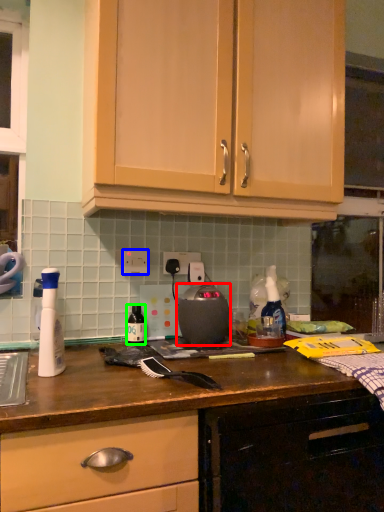
Question: Which is farther away from home appliance (highlighted by a red box)? electric outlet (highlighted by a blue box) or bottle (highlighted by a green box)?

Choices:
 (A) electric outlet
 (B) bottle

Answer: (A)